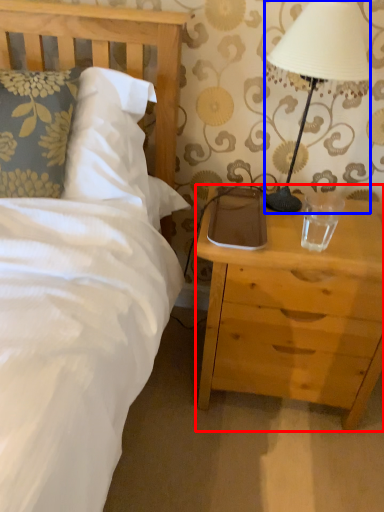
Question: Which of the following is the closest to the observer, nightstand (highlighted by a red box) or lamp (highlighted by a blue box)?

Choices:
 (A) nightstand
 (B) lamp

Answer: (B)